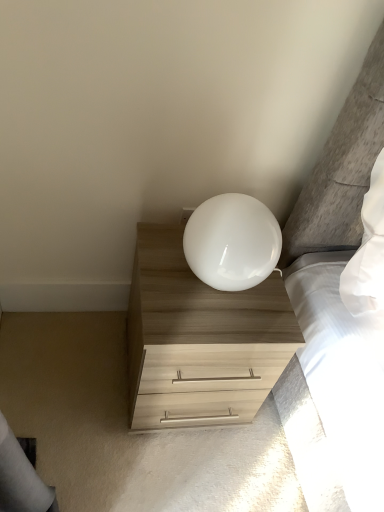
Identify the location of vacant space in front of white glossy lamp at upper center. (206, 325).